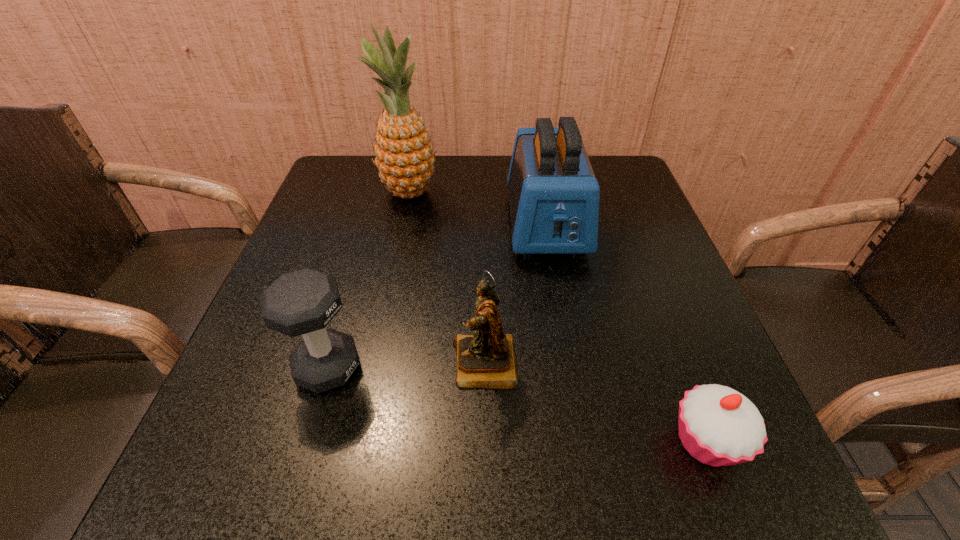
Where is `vacant point located between the dumbbell and the pineapple`? vacant point located between the dumbbell and the pineapple is located at coordinates (369, 280).

Locate an element on the screen. empty space between the pineapple and the fourth shortest object is located at coordinates (478, 208).

The width and height of the screenshot is (960, 540). In order to click on free space between the nearest object and the dumbbell in this screenshot , I will do `click(517, 404)`.

You are a GUI agent. You are given a task and a screenshot of the screen. Output one action in this format:
    pyautogui.click(x=<x>, y=<y>)
    Task: Click on the empty space that is in between the tallest object and the second tallest object
    This screenshot has width=960, height=540.
    Given the screenshot: What is the action you would take?
    pyautogui.click(x=478, y=208)

Locate an element on the screen. This screenshot has height=540, width=960. vacant point located between the dumbbell and the fourth object from left to right is located at coordinates (437, 295).

Locate an element on the screen. The width and height of the screenshot is (960, 540). unoccupied area between the third object from left to right and the pineapple is located at coordinates (447, 278).

Find the location of a particular element. free space between the cupcake and the second object from right to left is located at coordinates (627, 333).

The width and height of the screenshot is (960, 540). What are the coordinates of `empty space between the rightmost object and the second object from right to left` in the screenshot? It's located at (627, 333).

Identify which object is the second nearest to the pineapple. Please provide its 2D coordinates. Your answer should be formatted as a tuple, i.e. [(x, y)], where the tuple contains the x and y coordinates of a point satisfying the conditions above.

[(486, 359)]

Identify the location of the third closest object to the toaster. (718, 426).